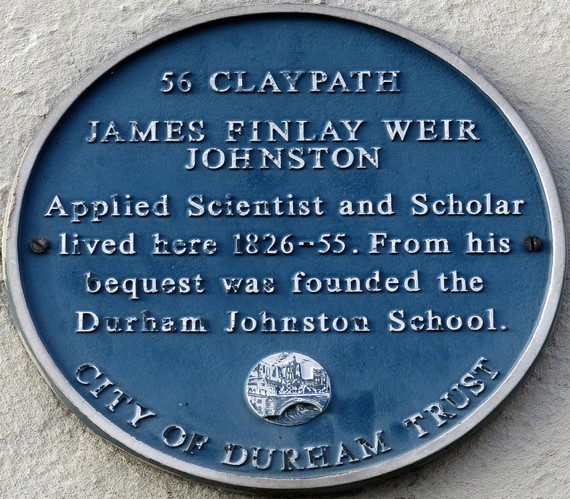
At what (x,y) coordinates should I click in order to perform the action: click on white wall. Please return your answer as a coordinate pair (x, y). Image resolution: width=570 pixels, height=499 pixels. Looking at the image, I should click on (522, 451).